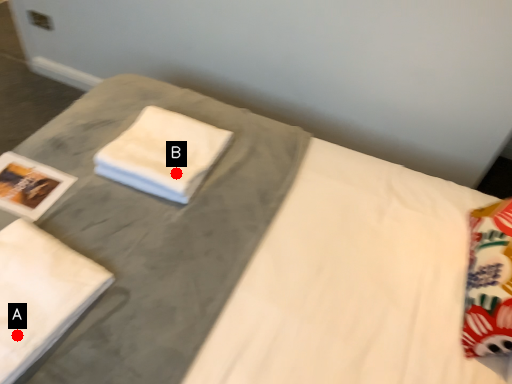
Question: Two points are circled on the image, labeled by A and B beside each circle. Among these points, which one is nearest to the camera?

Choices:
 (A) A is closer
 (B) B is closer

Answer: (A)